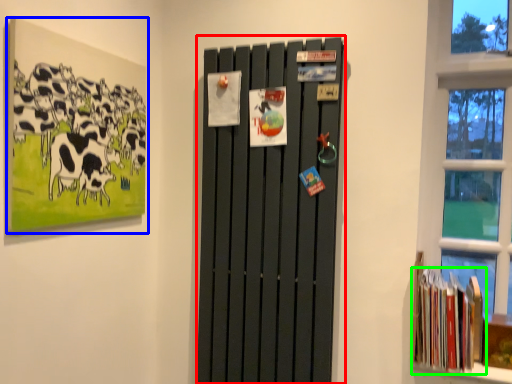
Question: Which object is positioned farthest from barn door (highlighted by a red box)? Select from picture frame (highlighted by a blue box) and book (highlighted by a green box).

Choices:
 (A) picture frame
 (B) book

Answer: (A)